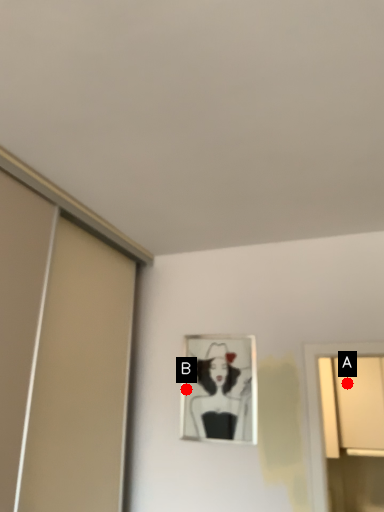
Question: Two points are circled on the image, labeled by A and B beside each circle. Which of the following is the farthest from the observer?

Choices:
 (A) A is further
 (B) B is further

Answer: (A)